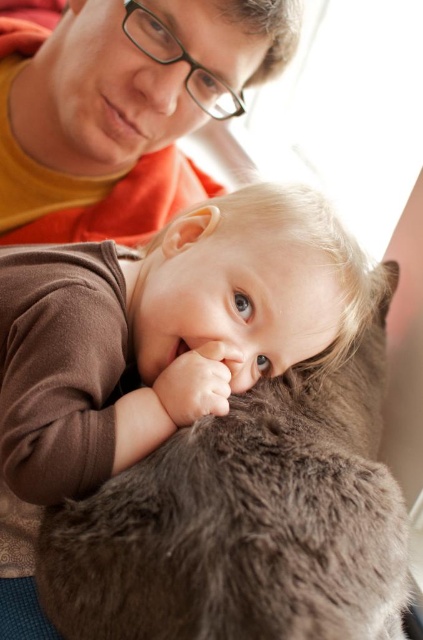
You are a photographer standing at a distance of 20 inches from the scene. You want to capture a closeup shot of the fuzzy brown cat at center without moving the camera. Is the cat within your camera frame?

The fuzzy brown cat at center is 21.06 inches from viewer. Since the photographer is 20 inches away, the cat is slightly farther than the camera can focus on for a closeup without moving closer. Therefore, the cat is just outside the optimal focus range for a closeup shot.

You are a photographer trying to capture the baby and the fuzzy brown cat at center in a portrait. The camera you are using has a focus point at the center of the frame, which is at coordinates point 0.5, 0.5. Based on the cat position at point 0.814, 0.579, will the cat be in focus?

The fuzzy brown cat at center is positioned at point (244, 520), which is outside the center focus point at (211, 320). Therefore, the cat will not be in focus.

You are designing a photo frame for this scene. The frame has a width limit of 18 inches. The fuzzy brown cat at center and the matte orange shirt at upper left must both fit within the frame. Given their widths, will the frame be wide enough?

The fuzzy brown cat at center is narrower than the matte orange shirt at upper left. Since the frame can only accommodate up to 18 inches, but we don not know the exact widths of either object, it is impossible to determine if their combined widths will exceed the frame limit. More information is needed.